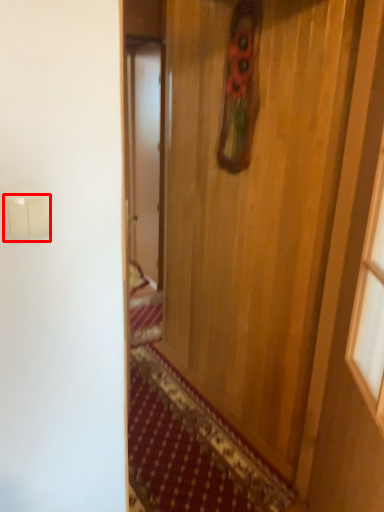
Question: From the image's perspective, what is the correct spatial positioning of light switch (annotated by the red box) in reference to door?

Choices:
 (A) below
 (B) above

Answer: (B)